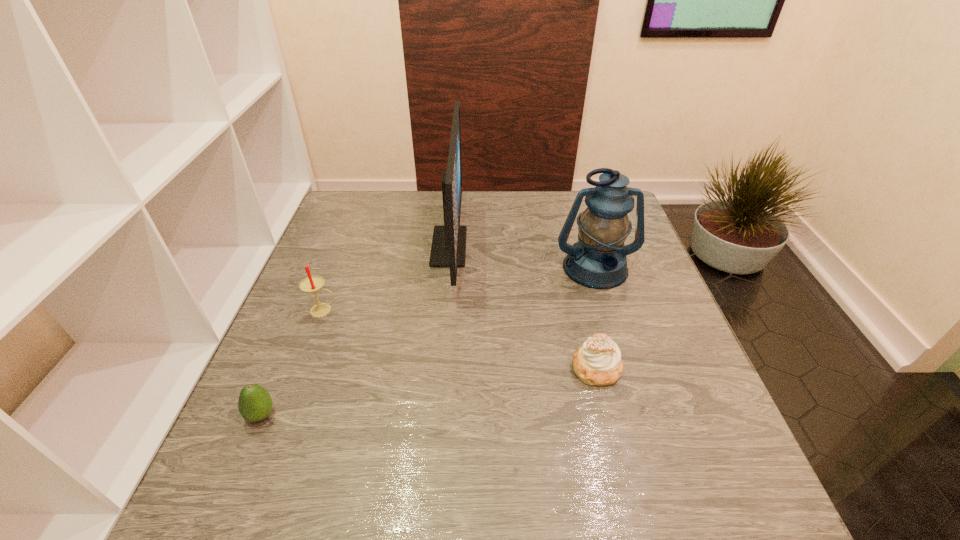
This screenshot has height=540, width=960. Identify the location of free region at the near right corner of the desktop. [675, 500].

Find the location of a particular element. The width and height of the screenshot is (960, 540). free space that is in between the pastry and the candle is located at coordinates (460, 339).

Where is `free spot between the second tallest object and the pastry`? This screenshot has height=540, width=960. free spot between the second tallest object and the pastry is located at coordinates (596, 318).

Locate an element on the screen. The width and height of the screenshot is (960, 540). vacant space in between the pastry and the candle is located at coordinates (460, 339).

Where is `empty location between the third tallest object and the fourth farthest object`? The image size is (960, 540). empty location between the third tallest object and the fourth farthest object is located at coordinates (460, 339).

Locate an element on the screen. Image resolution: width=960 pixels, height=540 pixels. free area in between the lantern and the computer monitor is located at coordinates (522, 258).

Identify the location of free spot between the computer monitor and the lantern. The height and width of the screenshot is (540, 960). (522, 258).

Locate an element on the screen. This screenshot has height=540, width=960. vacant area that lies between the lantern and the nearest object is located at coordinates (428, 341).

Where is `free space between the fourth shortest object and the nearest object`? free space between the fourth shortest object and the nearest object is located at coordinates (428, 341).

Identify the location of unoccupied position between the fourth farthest object and the third object from right to left. This screenshot has height=540, width=960. (522, 307).